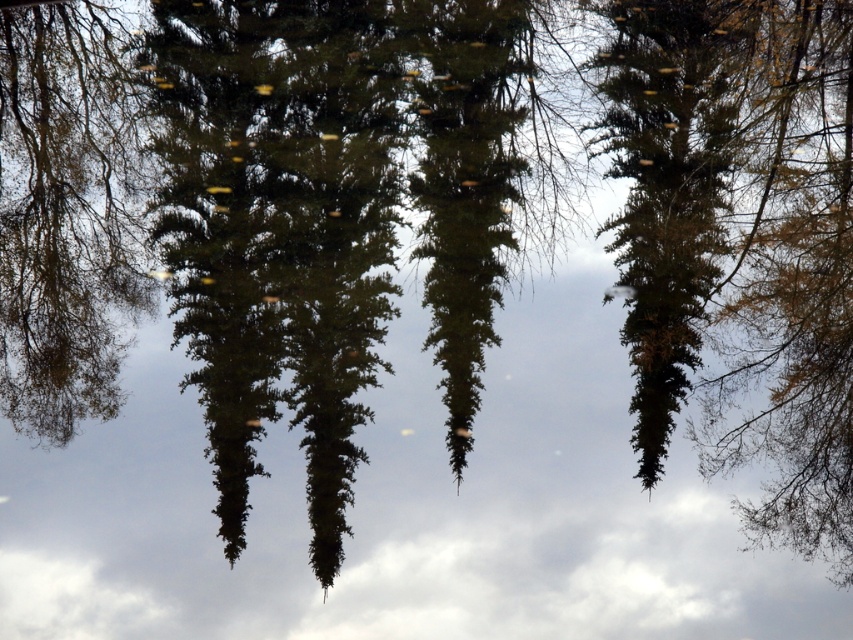
Question: Among these points, which one is nearest to the camera?

Choices:
 (A) (688, 308)
 (B) (839, 227)

Answer: (B)

Question: Which object is the farthest from the green matte tree at left?

Choices:
 (A) green matte tree at center
 (B) yellow-green needles at right

Answer: (B)

Question: Is yellow-green needles at right thinner than green matte tree at left?

Choices:
 (A) no
 (B) yes

Answer: (B)

Question: Can you confirm if yellow-green needles at right is wider than green matte tree at center?

Choices:
 (A) no
 (B) yes

Answer: (B)

Question: Which of the following is the farthest from the observer?

Choices:
 (A) (701, 40)
 (B) (41, 93)

Answer: (B)

Question: Does yellow-green needles at right have a larger size compared to green matte tree at left?

Choices:
 (A) yes
 (B) no

Answer: (A)